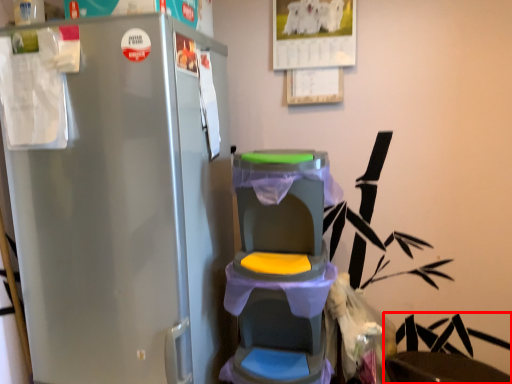
Question: From the image's perspective, where is swivel chair (annotated by the red box) located relative to baby carriage?

Choices:
 (A) above
 (B) below

Answer: (B)